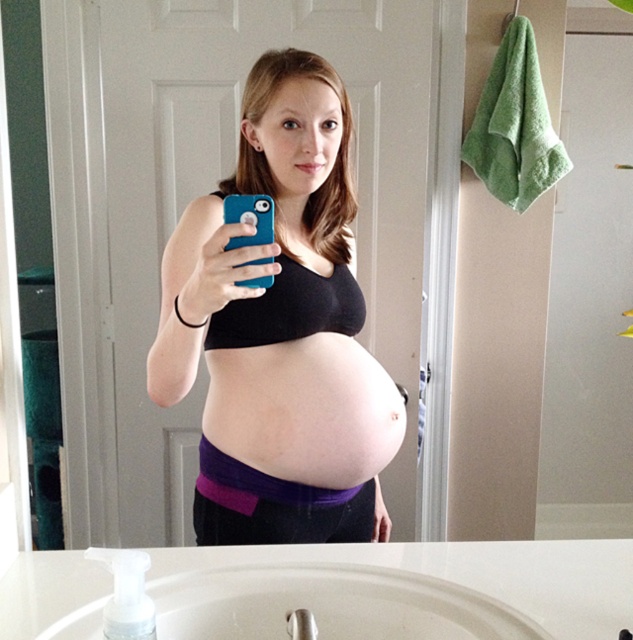
Who is more distant from viewer, (x=335, y=262) or (x=316, y=433)?

Positioned behind is point (x=335, y=262).

What are the coordinates of `matte black tank top at center` in the screenshot? It's located at (279, 330).

Locate an element on the screen. The height and width of the screenshot is (640, 633). matte black tank top at center is located at coordinates (279, 330).

In the scene shown: Who is taller, matte black tank top at center or white ceramic sink at lower center?

Standing taller between the two is matte black tank top at center.

Who is positioned more to the right, matte black tank top at center or white ceramic sink at lower center?

From the viewer's perspective, white ceramic sink at lower center appears more on the right side.

Where is `matte black tank top at center`? The width and height of the screenshot is (633, 640). matte black tank top at center is located at coordinates (279, 330).

Based on the photo, is white ceramic sink at lower center closer to camera compared to pink fabric at center?

Yes, white ceramic sink at lower center is in front of pink fabric at center.

Does white ceramic sink at lower center appear on the right side of pink fabric at center?

No, white ceramic sink at lower center is not to the right of pink fabric at center.

Who is more distant from viewer, (234, 596) or (335, 433)?

Positioned behind is point (335, 433).

Where is `white ceramic sink at lower center`? The height and width of the screenshot is (640, 633). white ceramic sink at lower center is located at coordinates (329, 604).